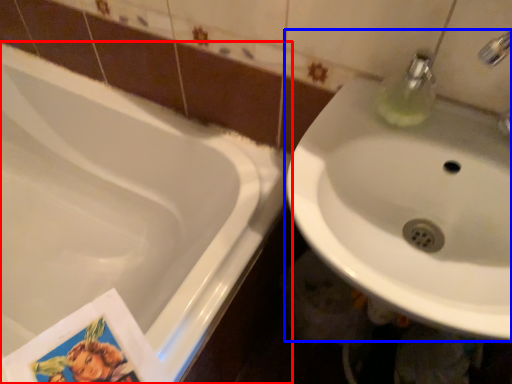
Question: Which object appears farthest to the camera in this image, bathtub (highlighted by a red box) or sink (highlighted by a blue box)?

Choices:
 (A) bathtub
 (B) sink

Answer: (A)